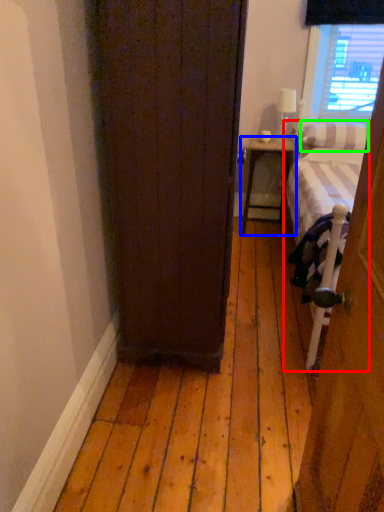
Question: Which object is the farthest from bed (highlighted by a red box)? Choose among these: nightstand (highlighted by a blue box) or pillow (highlighted by a green box).

Choices:
 (A) nightstand
 (B) pillow

Answer: (A)